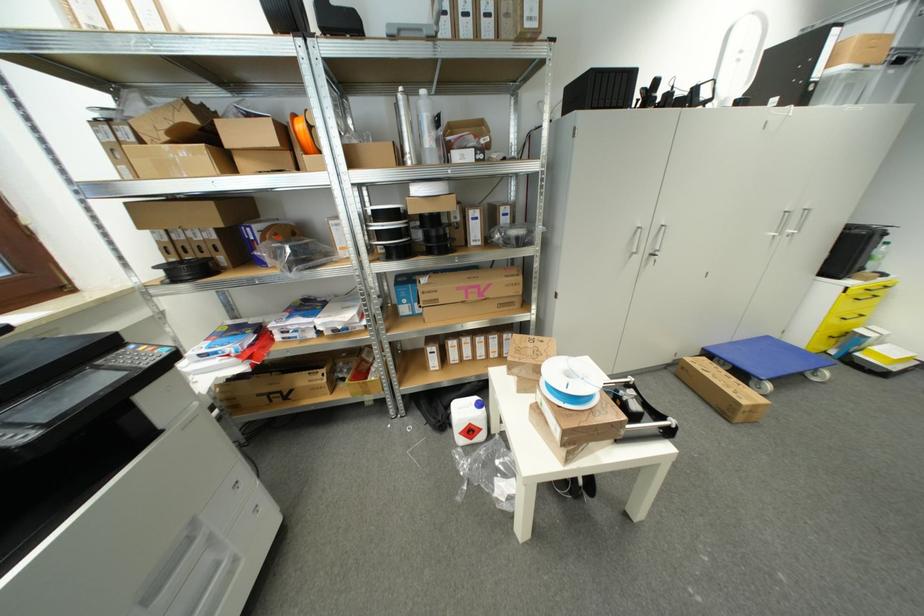
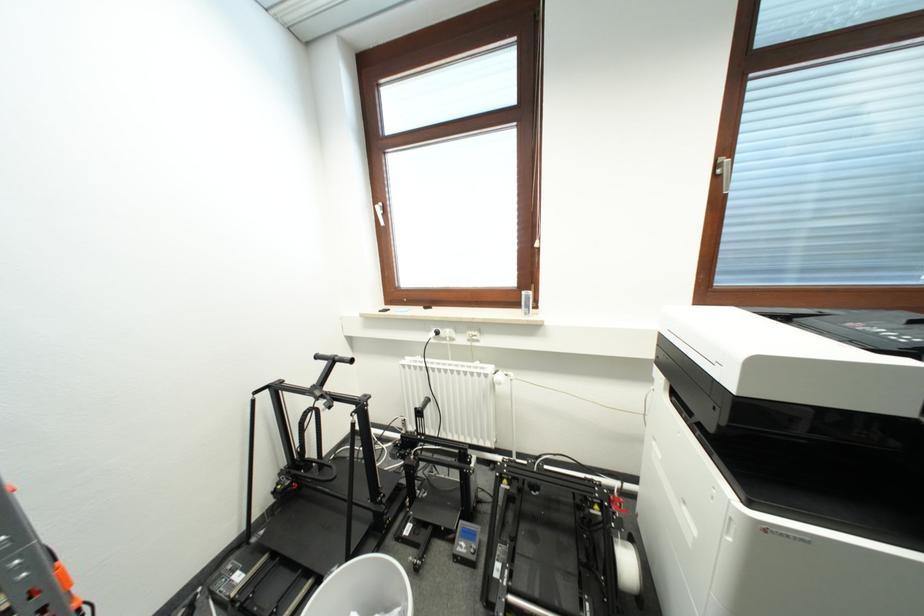
The images are taken continuously from a first-person perspective. In which direction is your viewpoint rotating?

The rotation direction of the camera is left-down.